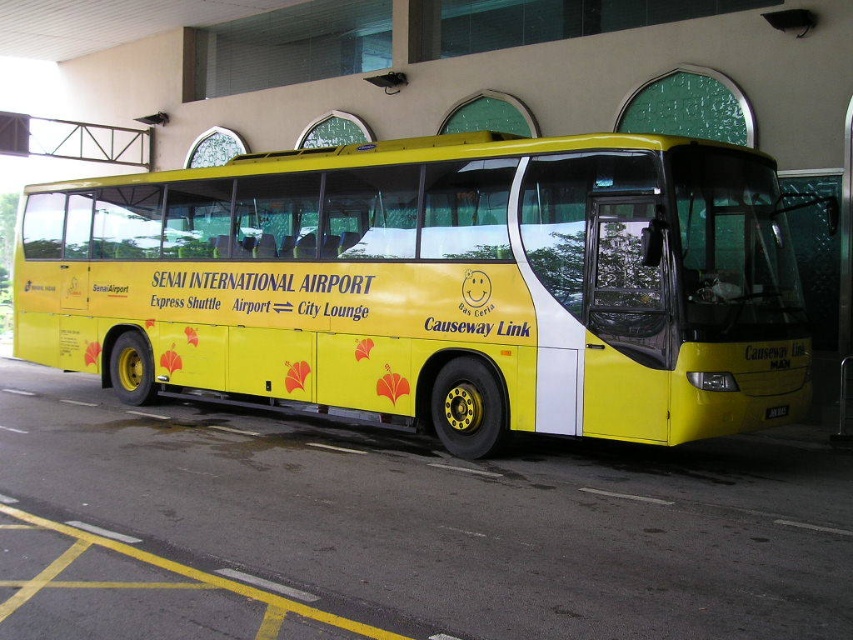
Is yellow matte bus at center above yellow asphalt at lower center?

Indeed, yellow matte bus at center is positioned over yellow asphalt at lower center.

Does yellow matte bus at center appear on the left side of yellow asphalt at lower center?

In fact, yellow matte bus at center is to the right of yellow asphalt at lower center.

Does point (270, 170) lie behind point (483, 513)?

Yes.

You are a GUI agent. You are given a task and a screenshot of the screen. Output one action in this format:
    pyautogui.click(x=<x>, y=<y>)
    Task: Click on the yellow matte bus at center
    The width and height of the screenshot is (853, 640).
    Given the screenshot: What is the action you would take?
    pyautogui.click(x=436, y=284)